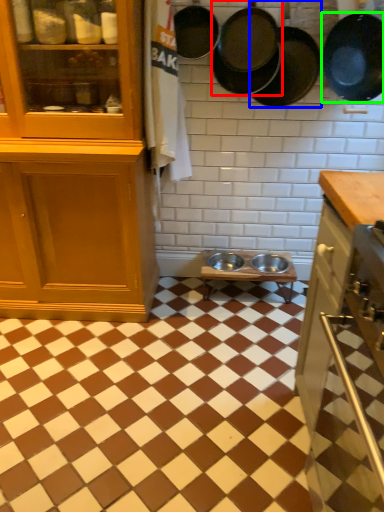
Question: Estimate the real-world distances between objects in this image. Which object is farther from frying pan (highlighted by a red box), frying pan (highlighted by a blue box) or frying pan (highlighted by a green box)?

Choices:
 (A) frying pan
 (B) frying pan

Answer: (B)